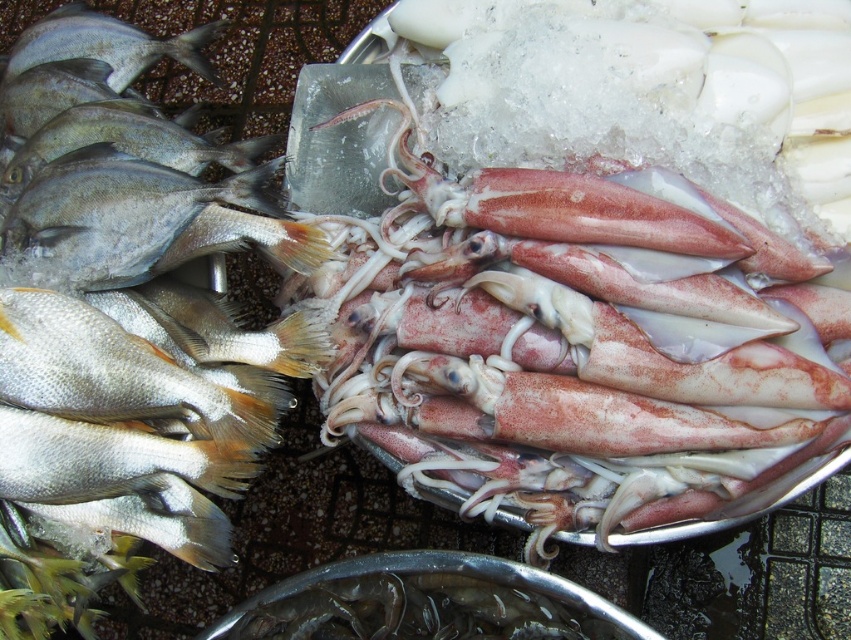
You are a customer at the seafood market. You want to buy the taller fish between the silver shiny fish at left and the shiny silver fish at left. Which one should you choose?

The shiny silver fish at left is taller than the silver shiny fish at left, so you should choose the shiny silver fish at left.

You are a customer at the seafood market looking at the silver shiny fish at left and the shiny silver fish at left. Which one is closer to you?

The silver shiny fish at left is closer to you because it is in front of the shiny silver fish at left.

You are a customer at the seafood market and want to buy the wider fish. Which one should you choose between the silver shiny fish at left and the shiny silver fish at left?

The silver shiny fish at left is wider than the shiny silver fish at left, so you should choose the silver shiny fish at left.